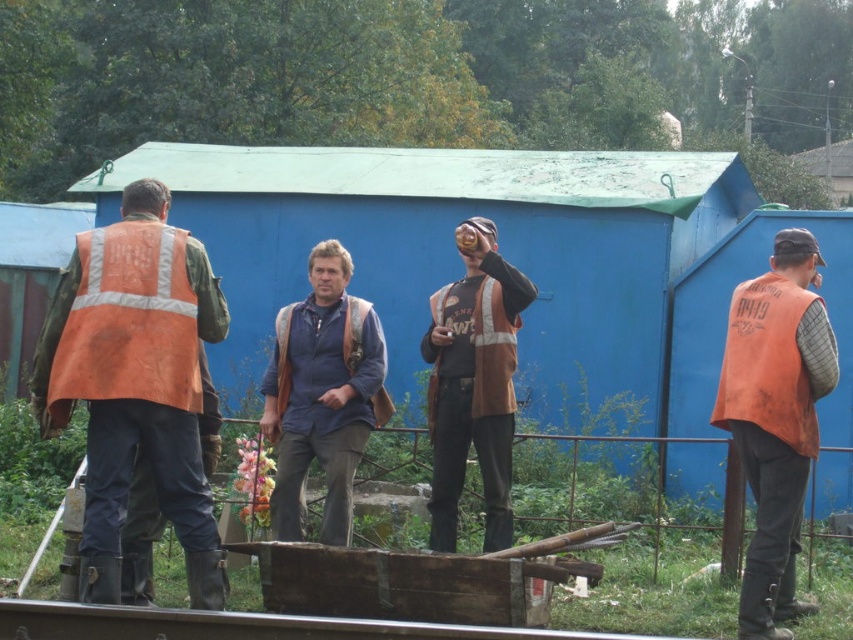
You are a safety inspector at a construction site. You need to ensure that workers are maintaining a safe distance of at least 20 inches apart for safety protocols. You observe two orange safety vests at the center of the scene. Are the workers wearing the orange reflective safety vest at center and the orange fabric safety vest at center complying with the social distancing guidelines?

The distance between the orange reflective safety vest at center and the orange fabric safety vest at center is 19.33 inches, which is less than the required 20 inches. Therefore, the workers are not complying with the social distancing guidelines.